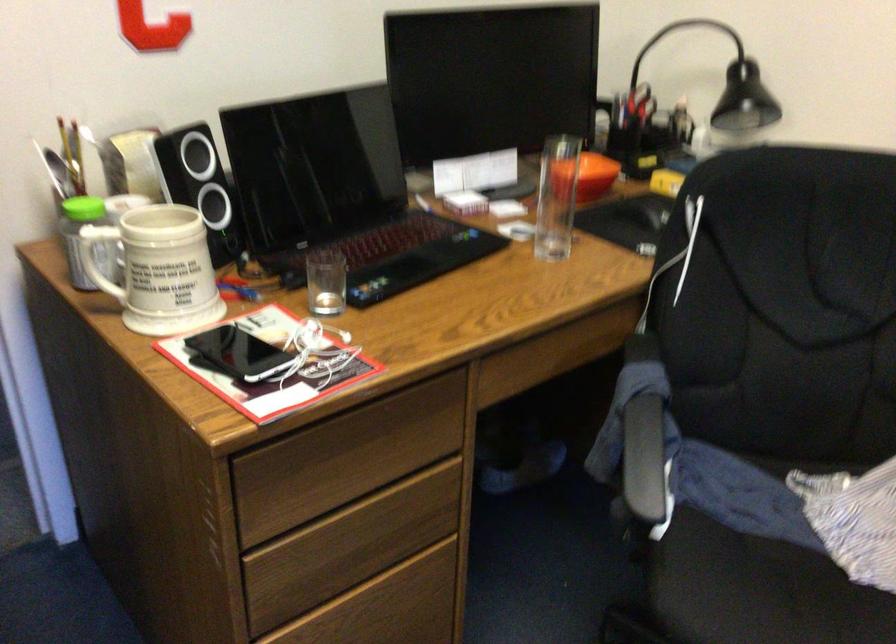
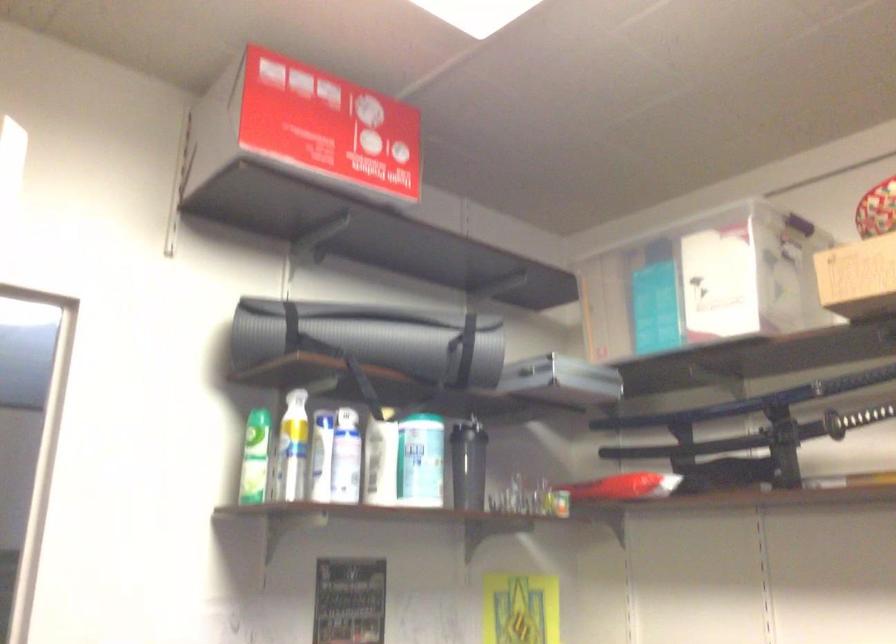
Question: How did the camera likely rotate?

Choices:
 (A) Left
 (B) Right
 (C) Up
 (D) Down

Answer: (C)